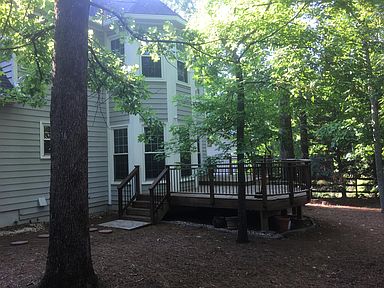
The width and height of the screenshot is (384, 288). In order to click on window in this screenshot , I will do tap(46, 142), tap(124, 158), tap(156, 156), tap(185, 156), tap(198, 149), tap(180, 71), tap(143, 64), tap(114, 44).